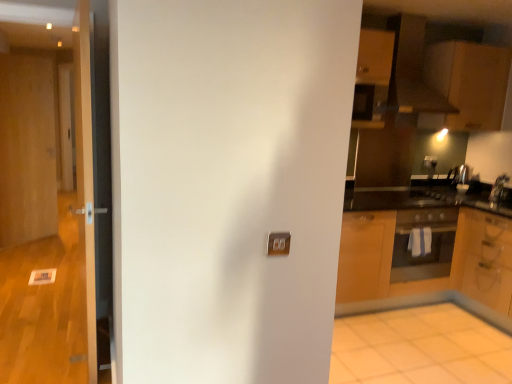
Question: Is wooden door at left, which is the 3th door from right to left, far away from white glossy door at left, the first door viewed from the front?

Choices:
 (A) yes
 (B) no

Answer: (A)

Question: Is wooden door at left, which ranks as the third door in front-to-back order, shorter than white glossy door at left, the first door viewed from the front?

Choices:
 (A) no
 (B) yes

Answer: (A)

Question: Is wooden door at left, which is the 3th door from right to left, not inside white glossy door at left, which ranks as the third door in left-to-right order?

Choices:
 (A) yes
 (B) no

Answer: (A)

Question: Does wooden door at left, which ranks as the third door in front-to-back order, have a lesser width compared to white glossy door at left, the first door viewed from the front?

Choices:
 (A) yes
 (B) no

Answer: (A)

Question: Considering the relative sizes of wooden door at left, the 1th door from the back, and white glossy door at left, marked as the 3th door in a back-to-front arrangement, in the image provided, is wooden door at left, the 1th door from the back, wider than white glossy door at left, marked as the 3th door in a back-to-front arrangement,?

Choices:
 (A) yes
 (B) no

Answer: (B)

Question: Visually, is wooden door at left, which ranks as the third door in front-to-back order, positioned to the left or to the right of wooden door at left, marked as the 2th door in a right-to-left arrangement?

Choices:
 (A) left
 (B) right

Answer: (A)

Question: Considering the positions of wooden door at left, acting as the first door starting from the left, and wooden door at left, which ranks as the 2th door in back-to-front order, in the image, is wooden door at left, acting as the first door starting from the left, bigger or smaller than wooden door at left, which ranks as the 2th door in back-to-front order,?

Choices:
 (A) small
 (B) big

Answer: (A)

Question: Is wooden door at left, acting as the first door starting from the left, situated inside wooden door at left, marked as the second door in a front-to-back arrangement, or outside?

Choices:
 (A) inside
 (B) outside

Answer: (B)

Question: Considering the positions of wooden door at left, which ranks as the third door in front-to-back order, and wooden door at left, marked as the second door in a front-to-back arrangement, in the image, is wooden door at left, which ranks as the third door in front-to-back order, wider or thinner than wooden door at left, marked as the second door in a front-to-back arrangement,?

Choices:
 (A) thin
 (B) wide

Answer: (A)

Question: In terms of size, does matte wood cabinetry at upper right, arranged as the second cabinetry when ordered from the bottom, appear bigger or smaller than white glossy tile at lower right?

Choices:
 (A) small
 (B) big

Answer: (B)

Question: In terms of width, does matte wood cabinetry at upper right, which appears as the first cabinetry when viewed from the top, look wider or thinner when compared to white glossy tile at lower right?

Choices:
 (A) wide
 (B) thin

Answer: (B)

Question: Relative to white glossy tile at lower right, is matte wood cabinetry at upper right, which appears as the first cabinetry when viewed from the top, in front or behind?

Choices:
 (A) behind
 (B) front

Answer: (A)

Question: Is point (508, 51) positioned closer to the camera than point (506, 357)?

Choices:
 (A) closer
 (B) farther

Answer: (B)

Question: Which is correct: wooden door at left, which ranks as the 2th door in back-to-front order, is inside matte black oven at right, or outside of it?

Choices:
 (A) outside
 (B) inside

Answer: (A)

Question: Is point click(x=87, y=132) positioned closer to the camera than point click(x=403, y=211)?

Choices:
 (A) farther
 (B) closer

Answer: (B)